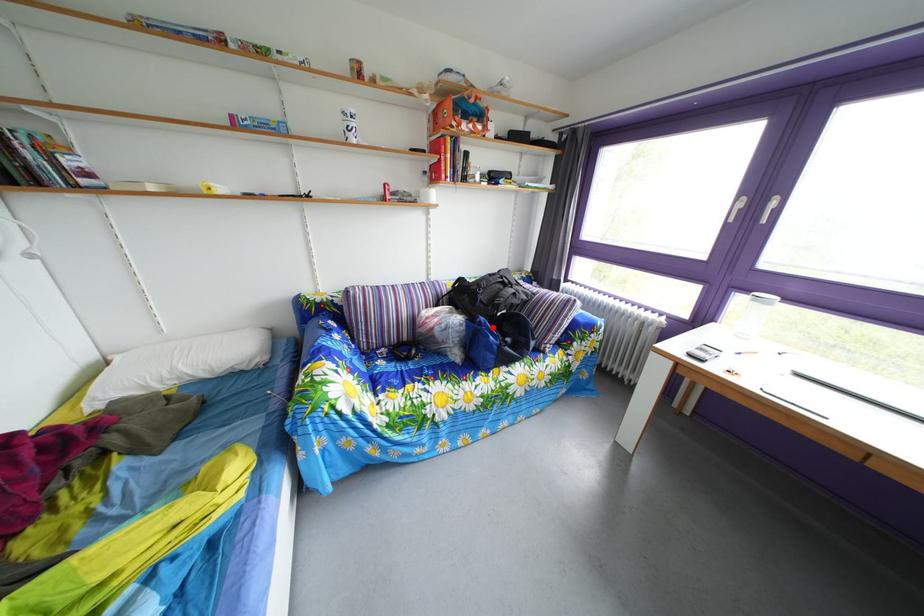
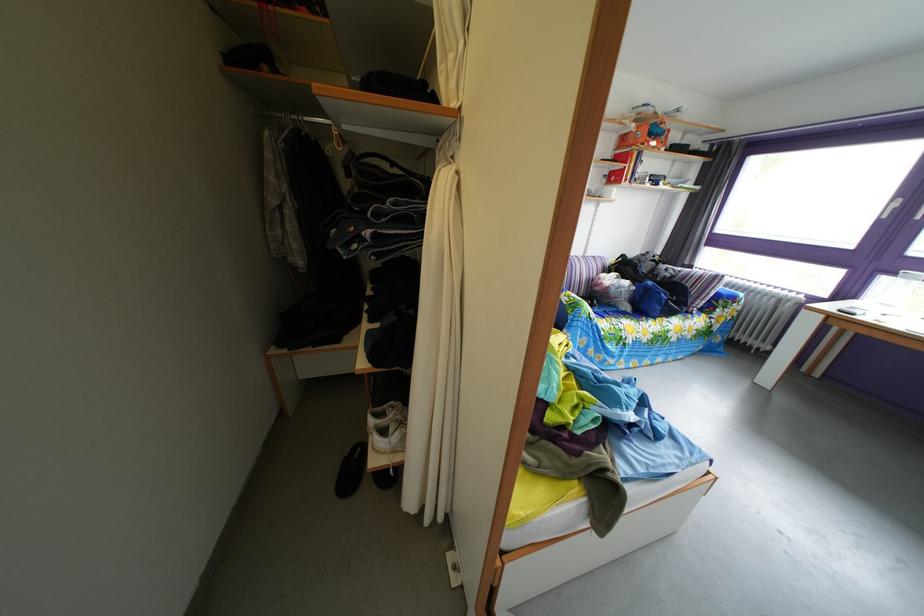
Question: I am providing you with two images of the same scene from different viewpoints. A red point is shown in image1. For the corresponding object point in image2, is it positioned nearer or farther from the camera?

Choices:
 (A) Nearer
 (B) Farther

Answer: (A)